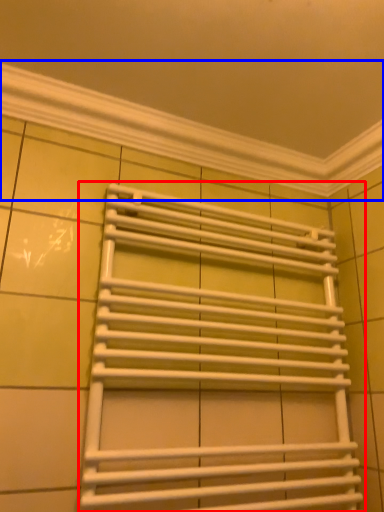
Question: Among these objects, which one is nearest to the camera, towel rack (highlighted by a red box) or window frame (highlighted by a blue box)?

Choices:
 (A) towel rack
 (B) window frame

Answer: (A)